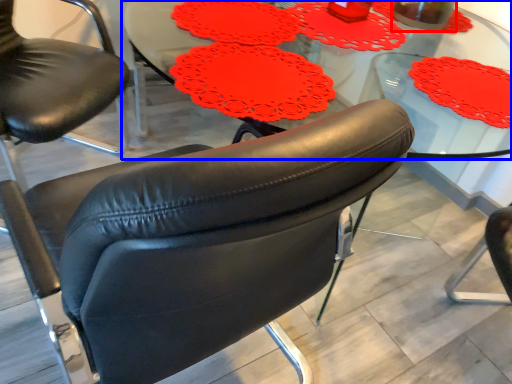
Question: Which point is further to the camera, beverage (highlighted by a red box) or table (highlighted by a blue box)?

Choices:
 (A) beverage
 (B) table

Answer: (A)